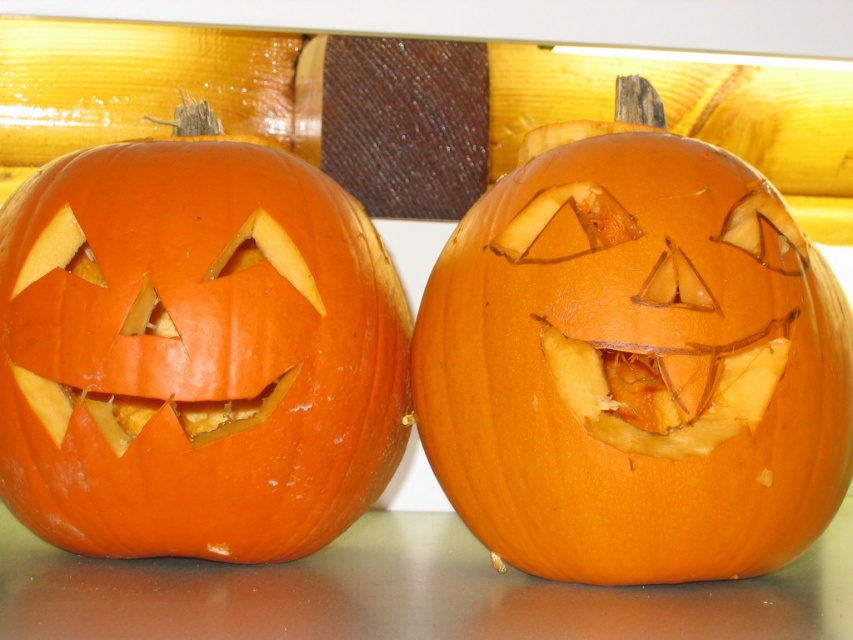
You are a child who wants to place a candy bowl exactly halfway between the orange carved pumpkin at center and the orange matte pumpkin at left. The candy bowl is 10 centimeters wide. Can you fit it between them without moving the pumpkins?

The distance between the orange carved pumpkin at center and the orange matte pumpkin at left is 19.18 centimeters. Since the candy bowl is 10 centimeters wide, there is enough space to place it halfway between them without moving the pumpkins.

You are setting up a Halloween display and need to arrange the orange carved pumpkin at center and the orange matte pumpkin at left on a shelf. The shelf has limited space, and you want to place the larger pumpkin closer to the edge to prevent it from tipping over. Which pumpkin should you place closer to the edge?

The orange carved pumpkin at center is larger in size than the orange matte pumpkin at left, so you should place the orange carved pumpkin at center closer to the edge to prevent it from tipping over.

You are setting up a Halloween display and want to arrange the orange carved pumpkin at center and the orange matte pumpkin at left on a shelf. The shelf has limited vertical space. Which pumpkin should you place first to ensure both fit vertically?

The orange matte pumpkin at left is shorter, so place it first to leave enough vertical space for the taller orange carved pumpkin at center.